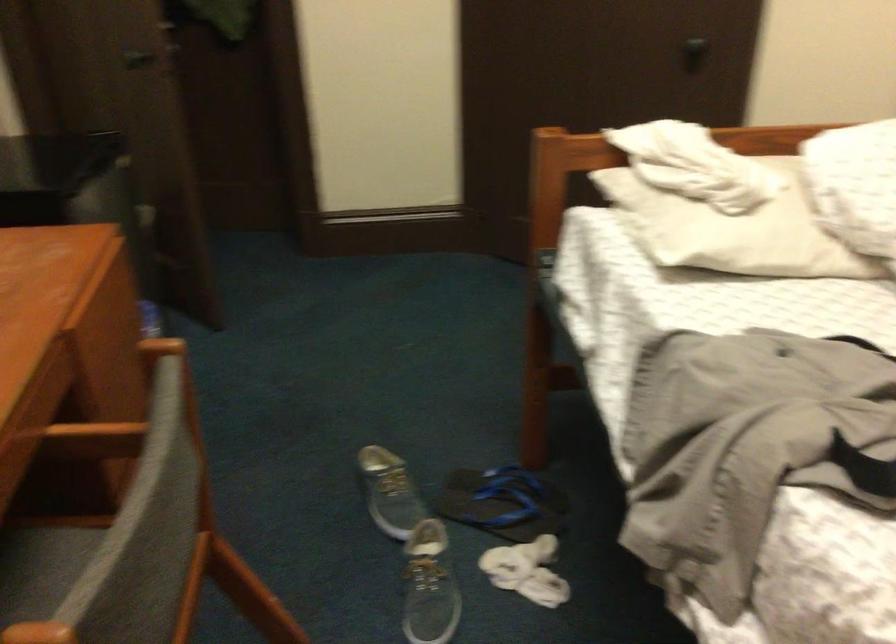
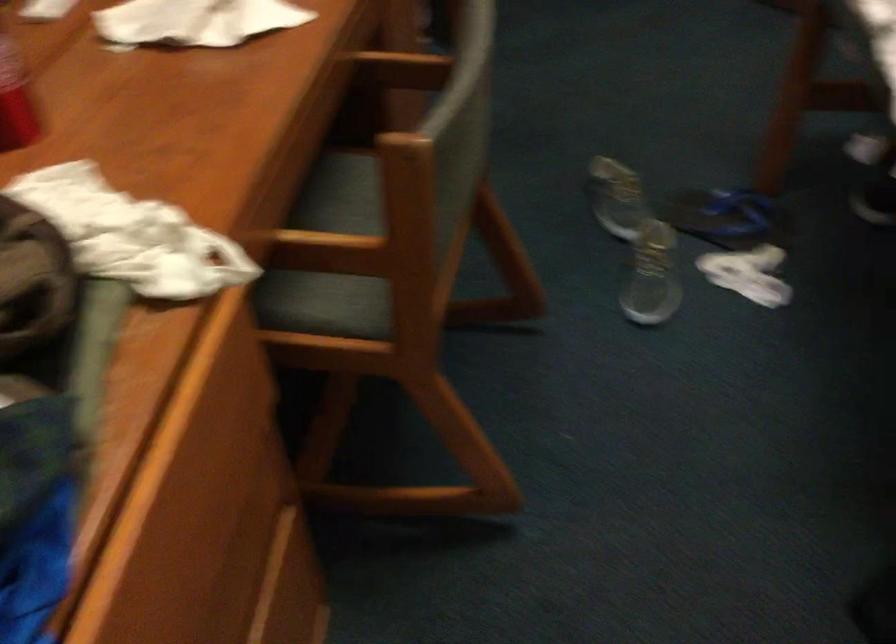
In the second image, find the point that corresponds to (x=497, y=507) in the first image.

(728, 218)